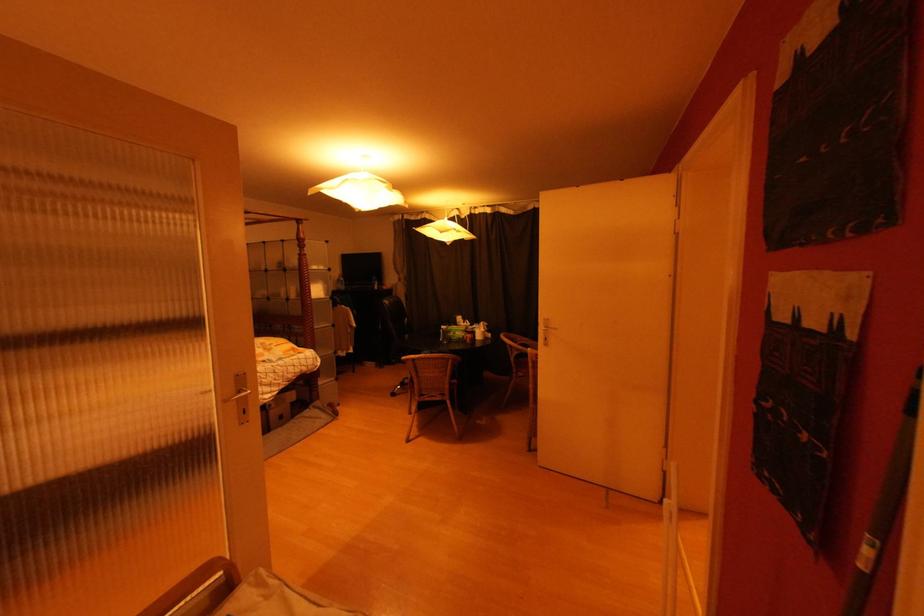
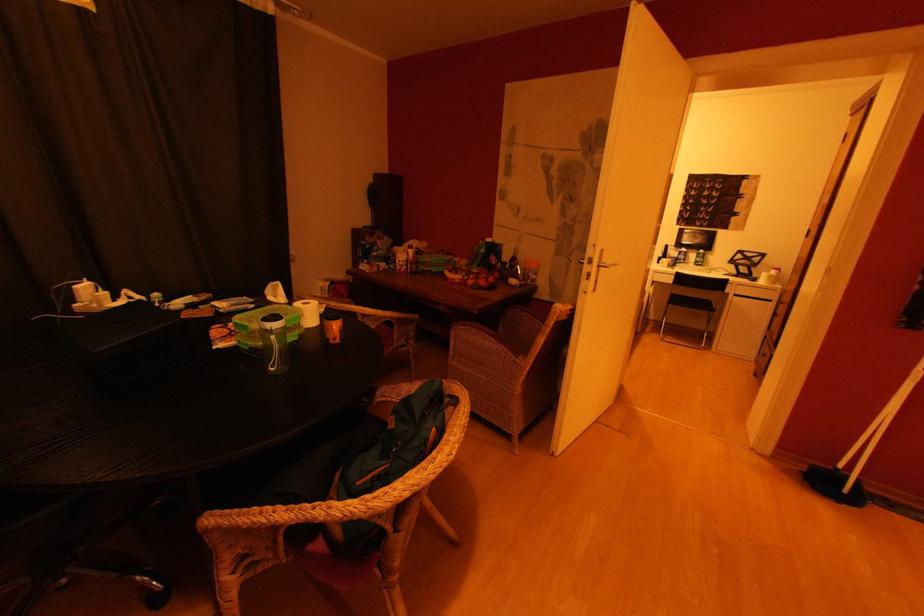
Find the pixel in the second image that matches (445,341) in the first image.

(276, 371)